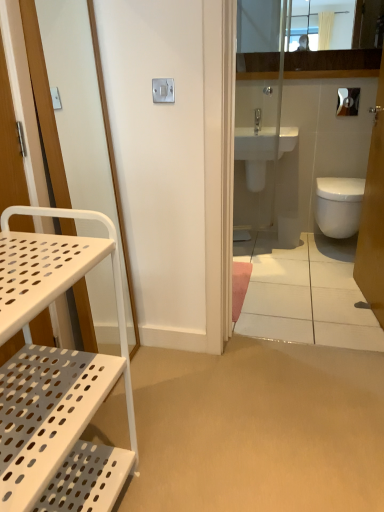
Identify the location of free spot below white glossy screen door at upper right, arranged as the 2th screen door when viewed from the left (from a real-world perspective). (363, 302).